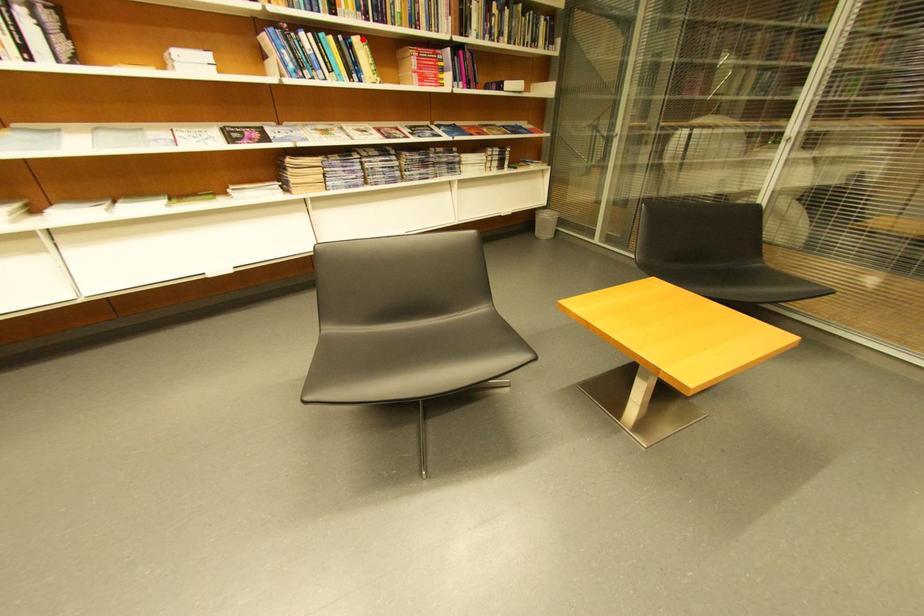
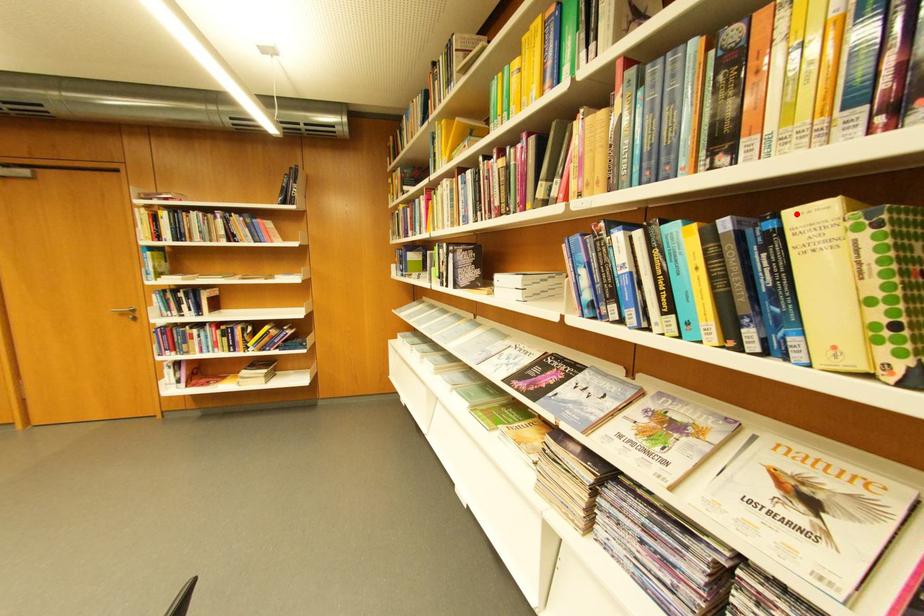
I am providing you with two images of the same scene from different viewpoints. A red point is marked on the first image and another point is marked on the second image. Is the red point in image1 aligned with the point shown in image2?

Yes